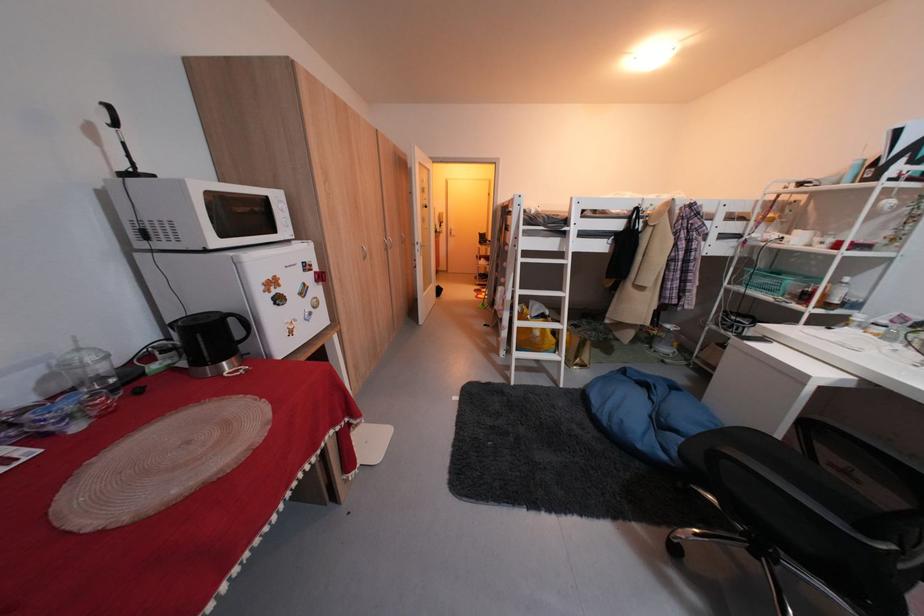
Identify the location of chair armrest. The width and height of the screenshot is (924, 616). (829, 509).